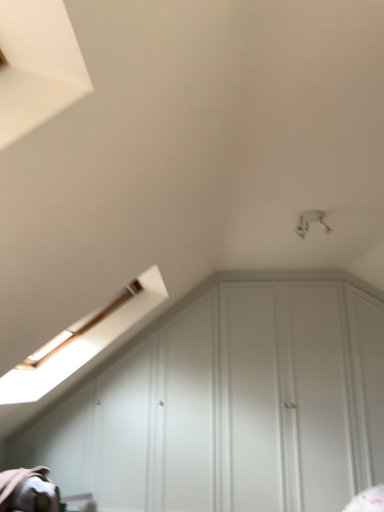
Find the location of a particular element. The height and width of the screenshot is (512, 384). white matte cabinet at lower center is located at coordinates (229, 403).

The width and height of the screenshot is (384, 512). Describe the element at coordinates (229, 403) in the screenshot. I see `white matte cabinet at lower center` at that location.

What is the approximate height of white glossy light fixture at upper right?

The height of white glossy light fixture at upper right is 5.54 inches.

What do you see at coordinates (310, 222) in the screenshot? This screenshot has height=512, width=384. I see `white glossy light fixture at upper right` at bounding box center [310, 222].

You are a GUI agent. You are given a task and a screenshot of the screen. Output one action in this format:
    pyautogui.click(x=<x>, y=<y>)
    Task: Click on the white glossy light fixture at upper right
    Image resolution: width=384 pixels, height=512 pixels.
    Given the screenshot: What is the action you would take?
    pyautogui.click(x=310, y=222)

This screenshot has width=384, height=512. I want to click on white matte cabinet at lower center, so click(229, 403).

Considering the positions of objects white glossy light fixture at upper right and white matte cabinet at lower center in the image provided, who is more to the left, white glossy light fixture at upper right or white matte cabinet at lower center?

From the viewer's perspective, white matte cabinet at lower center appears more on the left side.

Is white glossy light fixture at upper right further to the viewer compared to white matte cabinet at lower center?

No, white glossy light fixture at upper right is in front of white matte cabinet at lower center.

Considering the positions of point (307, 229) and point (320, 457), is point (307, 229) closer or farther from the camera than point (320, 457)?

Clearly, point (307, 229) is closer to the camera than point (320, 457).

From the image's perspective, which one is positioned higher, white glossy light fixture at upper right or white matte cabinet at lower center?

white glossy light fixture at upper right appears higher in the image.

From a real-world perspective, which is physically above, white glossy light fixture at upper right or white matte cabinet at lower center?

white glossy light fixture at upper right, from a real-world perspective.

Does white glossy light fixture at upper right have a lesser width compared to white matte cabinet at lower center?

Incorrect, the width of white glossy light fixture at upper right is not less than that of white matte cabinet at lower center.

Is white glossy light fixture at upper right shorter than white matte cabinet at lower center?

Yes.

Considering the sizes of objects white glossy light fixture at upper right and white matte cabinet at lower center in the image provided, who is smaller, white glossy light fixture at upper right or white matte cabinet at lower center?

white glossy light fixture at upper right.

Choose the correct answer: Is white glossy light fixture at upper right inside white matte cabinet at lower center or outside it?

white glossy light fixture at upper right exists outside the volume of white matte cabinet at lower center.

Is white glossy light fixture at upper right next to white matte cabinet at lower center?

No, white glossy light fixture at upper right is not beside white matte cabinet at lower center.

Is white glossy light fixture at upper right oriented away from white matte cabinet at lower center?

Correct, white glossy light fixture at upper right is looking away from white matte cabinet at lower center.

The width and height of the screenshot is (384, 512). What are the coordinates of `light fixture lying in front of the white matte cabinet at lower center` in the screenshot? It's located at (310, 222).

Which is more to the right, white matte cabinet at lower center or white glossy light fixture at upper right?

white glossy light fixture at upper right is more to the right.

Which is in front, white matte cabinet at lower center or white glossy light fixture at upper right?

Positioned in front is white glossy light fixture at upper right.

Does point (167, 418) come closer to viewer compared to point (309, 221)?

That is False.

From the image's perspective, is white matte cabinet at lower center located above white glossy light fixture at upper right?

No, from the image's perspective, white matte cabinet at lower center is not over white glossy light fixture at upper right.

From a real-world perspective, who is located lower, white matte cabinet at lower center or white glossy light fixture at upper right?

white matte cabinet at lower center.

Which of these two, white matte cabinet at lower center or white glossy light fixture at upper right, is thinner?

white matte cabinet at lower center is thinner.

Between white matte cabinet at lower center and white glossy light fixture at upper right, which one has more height?

Standing taller between the two is white matte cabinet at lower center.

From the picture: Which of these two, white matte cabinet at lower center or white glossy light fixture at upper right, is bigger?

Bigger between the two is white matte cabinet at lower center.

Is white matte cabinet at lower center completely or partially outside of white glossy light fixture at upper right?

Yes, white matte cabinet at lower center is outside of white glossy light fixture at upper right.

Is white matte cabinet at lower center touching white glossy light fixture at upper right?

white matte cabinet at lower center and white glossy light fixture at upper right are clearly separated.

Is white matte cabinet at lower center facing towards white glossy light fixture at upper right?

Yes, white matte cabinet at lower center faces towards white glossy light fixture at upper right.

Find the location of a particular element. The height and width of the screenshot is (512, 384). dresser behind the white glossy light fixture at upper right is located at coordinates (229, 403).

Where is `light fixture above the white matte cabinet at lower center (from a real-world perspective)`? The width and height of the screenshot is (384, 512). light fixture above the white matte cabinet at lower center (from a real-world perspective) is located at coordinates (310, 222).

Where is `dresser that is under the white glossy light fixture at upper right (from a real-world perspective)`? This screenshot has height=512, width=384. dresser that is under the white glossy light fixture at upper right (from a real-world perspective) is located at coordinates (229, 403).